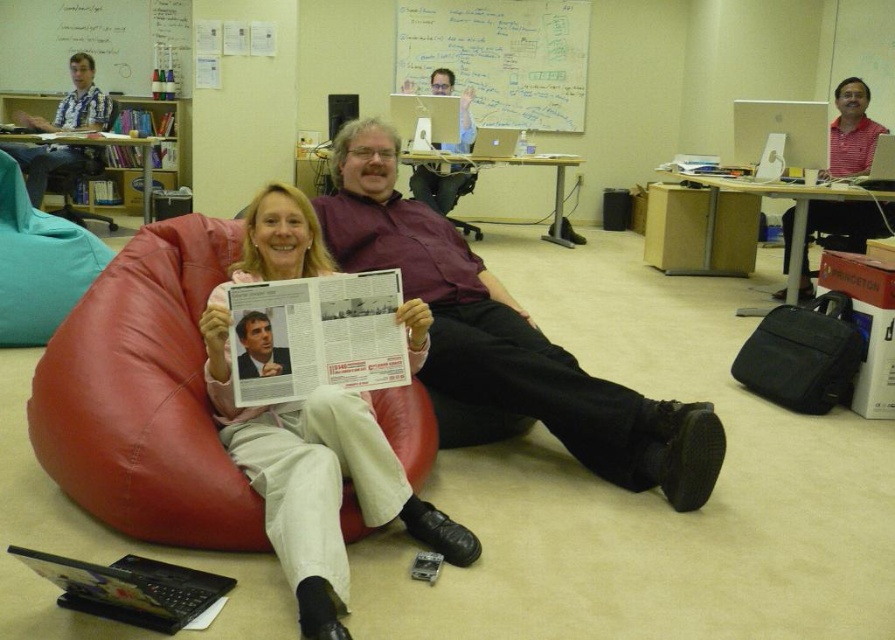
Question: Which of the following is the closest to the observer?

Choices:
 (A) (105, 42)
 (B) (437, 19)
 (C) (629, 404)
 (D) (276, 252)

Answer: (D)

Question: Can you confirm if red leather bean bag chair at center is positioned above whiteboard at upper center?

Choices:
 (A) yes
 (B) no

Answer: (B)

Question: Among these objects, which one is farthest from the camera?

Choices:
 (A) matte black shirt at center
 (B) whiteboard at upper center
 (C) maroon shirt at center
 (D) whiteboard at upper left

Answer: (B)

Question: Which point is closer to the camera?

Choices:
 (A) whiteboard at upper left
 (B) matte black shirt at center
 (C) red leather bean bag chair at center
 (D) whiteboard at upper center

Answer: (C)

Question: Is red leather bean bag chair at center smaller than maroon shirt at center?

Choices:
 (A) no
 (B) yes

Answer: (B)

Question: Does red leather bean bag chair at center have a lesser width compared to teal fabric swivel chair at left?

Choices:
 (A) no
 (B) yes

Answer: (A)